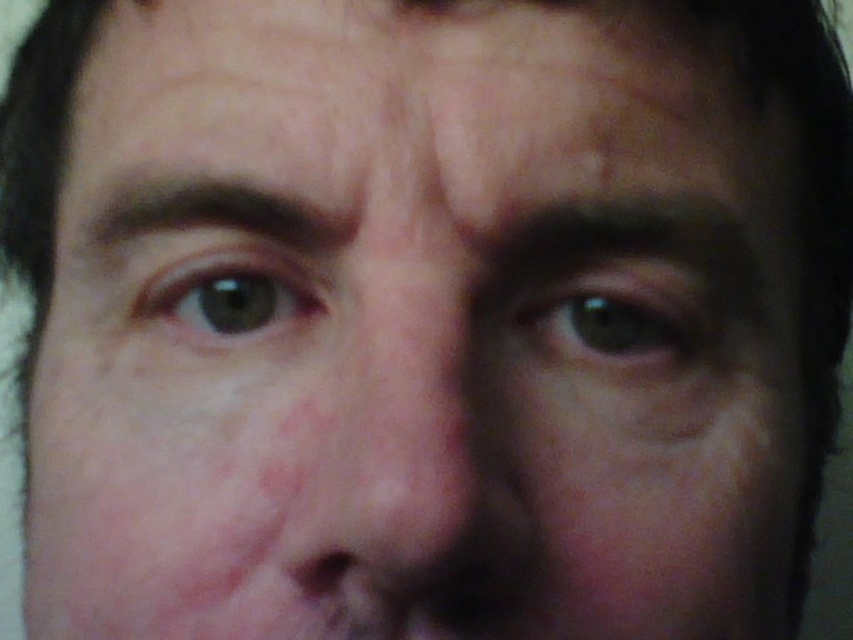
You are a photographer adjusting lighting for a portrait. You notice the smooth skin nose at center and the green matte eye at center in your viewfinder. Which object is positioned to the right side of the viewfinder?

The green matte eye at center is positioned to the right side of the viewfinder because the smooth skin nose at center is to its left.

You are an optometrist examining a patient. You notice two green matte eyes in the image. Which eye is closer to you, the green matte eye at center or the green matte eye at upper left?

The green matte eye at center is closer to you because it is further to the viewer than the green matte eye at upper left.